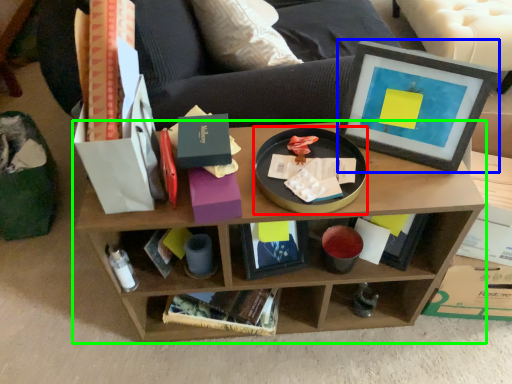
Question: Which object is positioned closest to round table (highlighted by a red box)? Select from picture frame (highlighted by a blue box) and shelf (highlighted by a green box).

Choices:
 (A) picture frame
 (B) shelf

Answer: (A)